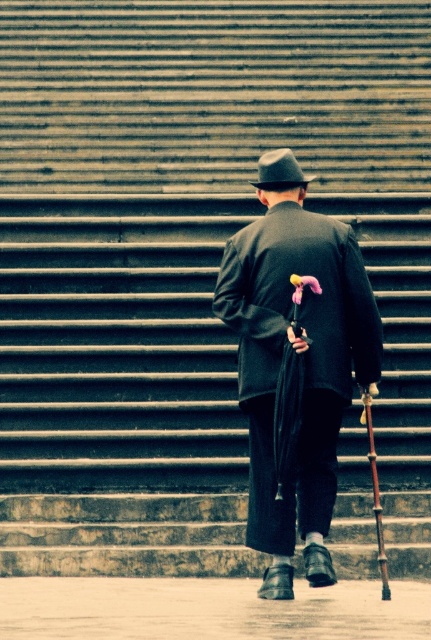
You are standing at the point marked as point [296,371] in the image. What object is located exactly at this point?

The matte black coat at center is located exactly at point [296,371].

You are a fashion designer observing the man in the scene. You need to determine which item of his clothing or accessories is taller between the matte black coat at center and the matte black fedora at center. Which one is taller?

The matte black coat at center is taller than the matte black fedora at center.